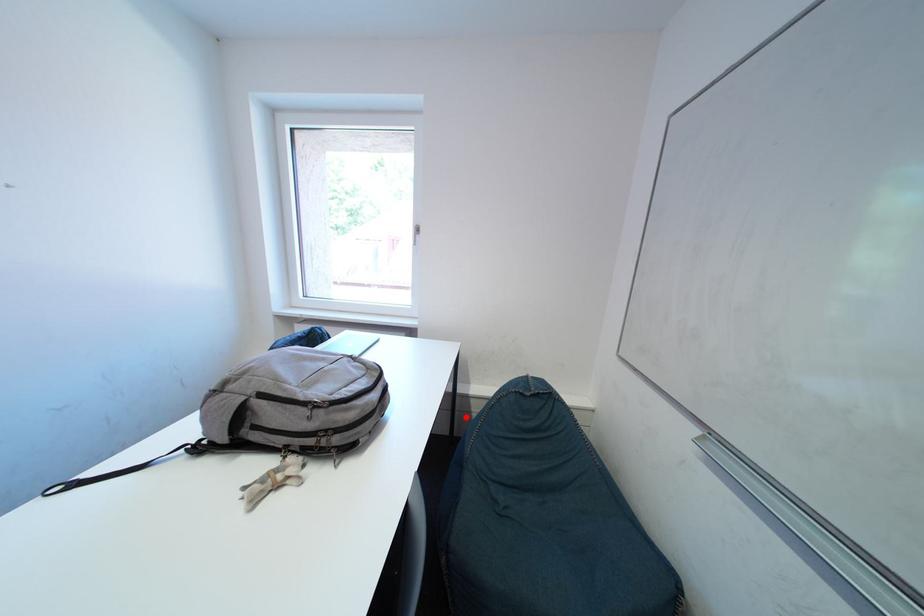
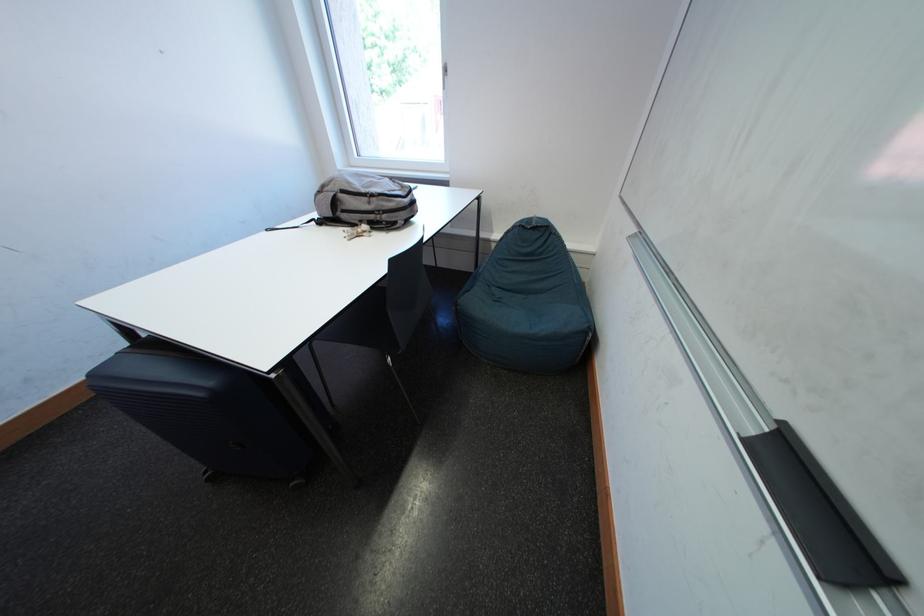
Find the pixel in the second image that matches the highlighted location in the first image.

(490, 259)